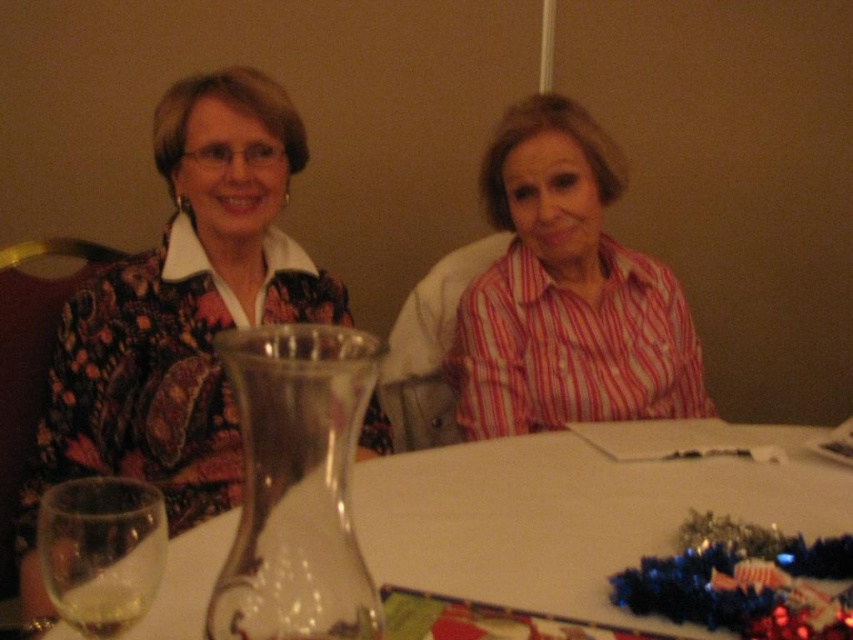
Looking at this image, who is lower down, printed fabric blouse at left or clear glass carafe at center?

clear glass carafe at center is lower down.

Who is more forward, (254, 205) or (531, 545)?

Point (531, 545)

At what (x,y) coordinates should I click in order to perform the action: click on printed fabric blouse at left. Please return your answer as a coordinate pair (x, y). This screenshot has width=853, height=640. Looking at the image, I should click on tap(180, 312).

Is clear glass carafe at center smaller than clear glass wine glass at lower left?

No, clear glass carafe at center is not smaller than clear glass wine glass at lower left.

Is clear glass carafe at center taller than clear glass wine glass at lower left?

Indeed, clear glass carafe at center has a greater height compared to clear glass wine glass at lower left.

Is point (469, 452) in front of point (107, 636)?

That is False.

Where is `clear glass carafe at center`? Image resolution: width=853 pixels, height=640 pixels. clear glass carafe at center is located at coordinates (576, 513).

In the scene shown: Who is more distant from viewer, (410, 458) or (59, 612)?

Positioned behind is point (410, 458).

Measure the distance between point (x=212, y=557) and camera.

85.95 centimeters

The height and width of the screenshot is (640, 853). Identify the location of clear glass carafe at center. (576, 513).